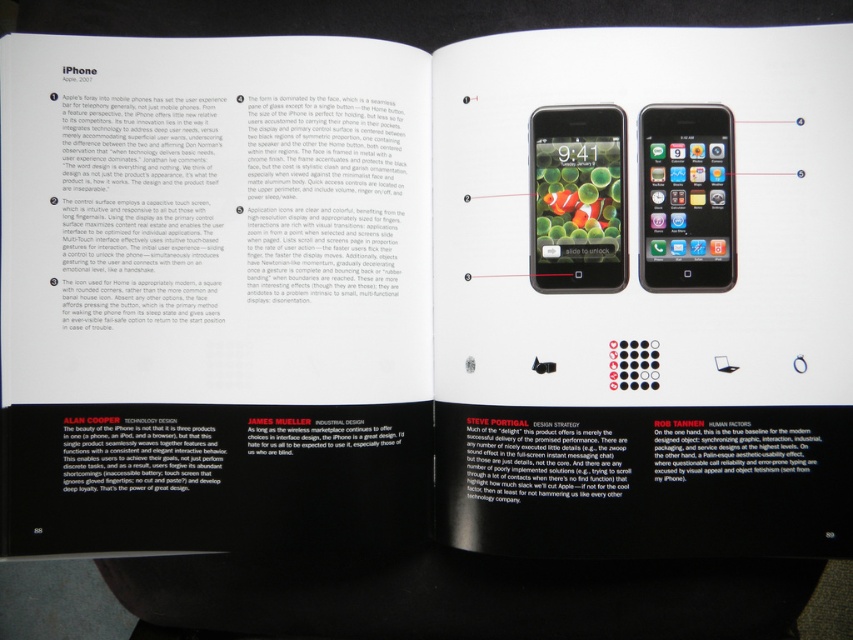
Is point (572, 204) less distant than point (674, 124)?

No, (572, 204) is further to viewer.

Which is more to the right, matte black iphone at center or matte black iphone at upper center?

matte black iphone at upper center

Does point (590, 220) come closer to viewer compared to point (717, 256)?

No.

Find the location of a particular element. matte black iphone at center is located at coordinates 577,198.